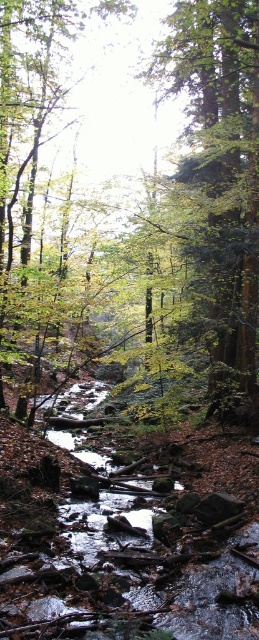
You are a hiker in the forest and want to climb a tree to get a better view. You see a green leafy tree at center and a green matte tree at center. Which tree should you choose if you want to climb higher?

The green leafy tree at center is much taller than the green matte tree at center, so you should choose the green leafy tree at center to climb higher.

You are standing at the origin point in the forest scene. You want to locate the green leafy tree at center. In which direction should you move relative to your current position?

The green leafy tree at center is located at point 0.305 on the x axis and 0.784 on the y axis. Since you are at the origin, you should move towards the positive x and positive y direction to reach it.

You are a hiker standing in the forest and see the green leafy tree at center and the green matte tree at center. Which tree is closer to you?

The green leafy tree at center is closer to you because it is positioned over the green matte tree at center, indicating it is in front.